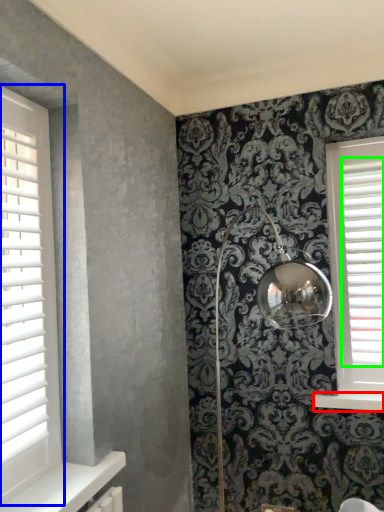
Question: Based on their relative distances, which object is nearer to window sill (highlighted by a red box)? Choose from window (highlighted by a blue box) and blind (highlighted by a green box).

Choices:
 (A) window
 (B) blind

Answer: (B)